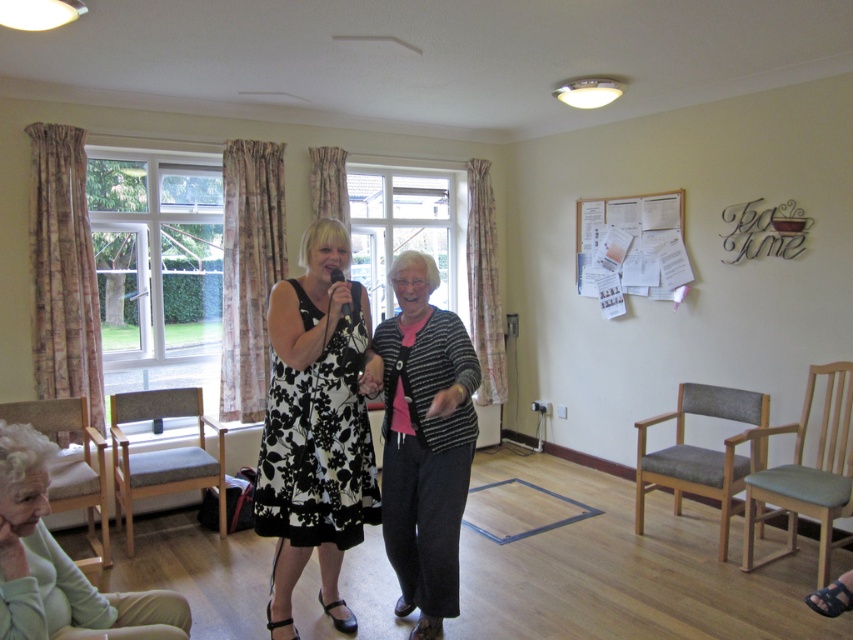
Question: From the image, what is the correct spatial relationship of black floral dress at center in relation to black matte microphone at center?

Choices:
 (A) below
 (B) above

Answer: (A)

Question: Does striped sweater at center appear on the left side of gray fabric armchair at left?

Choices:
 (A) no
 (B) yes

Answer: (A)

Question: Among these objects, which one is nearest to the camera?

Choices:
 (A) gray fabric armchair at right
 (B) light beige fabric armchair at lower left
 (C) gray fabric armchair at left
 (D) light gray fabric armchair at right

Answer: (D)

Question: Which point is farther to the camera?

Choices:
 (A) light beige fabric armchair at lower left
 (B) black matte microphone at center
 (C) light green fabric chair at lower left
 (D) gray fabric armchair at right

Answer: (D)

Question: Does striped sweater at center have a larger size compared to gray fabric armchair at right?

Choices:
 (A) no
 (B) yes

Answer: (B)

Question: Among these points, which one is farthest from the camera?

Choices:
 (A) (389, 400)
 (B) (790, 481)
 (C) (96, 502)

Answer: (C)